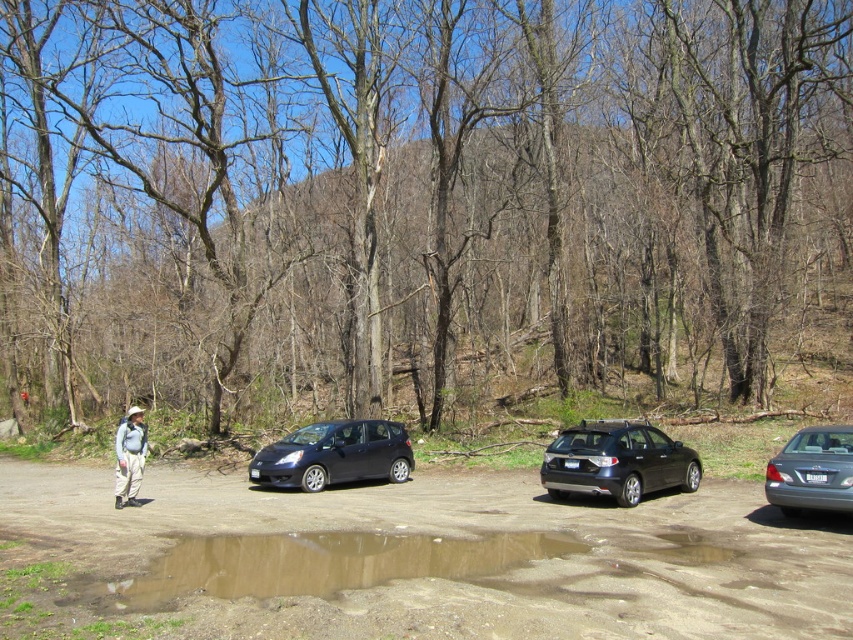
Question: Which of these objects is positioned closest to the brown bark tree at center?

Choices:
 (A) matte black hatchback at center
 (B) khaki pants at left
 (C) brown sandy puddle at center

Answer: (A)

Question: Among these objects, which one is nearest to the camera?

Choices:
 (A) brown dirt track at lower center
 (B) khaki pants at left
 (C) matte black hatchback at center

Answer: (A)

Question: Which point is farther to the camera?

Choices:
 (A) satin silver sedan at right
 (B) khaki pants at left
 (C) brown dirt track at lower center

Answer: (B)

Question: Is matte black hatchback at center bigger than satin silver sedan at right?

Choices:
 (A) no
 (B) yes

Answer: (B)

Question: Does brown sandy puddle at center have a lesser width compared to khaki pants at left?

Choices:
 (A) no
 (B) yes

Answer: (B)

Question: Does brown bark tree at center appear over satin silver sedan at right?

Choices:
 (A) no
 (B) yes

Answer: (B)